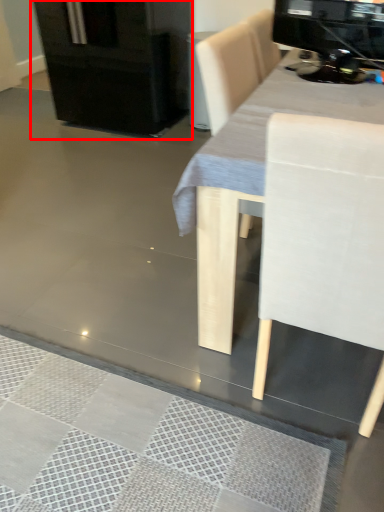
Question: From the image's perspective, considering the relative positions of fridge (annotated by the red box) and appliance in the image provided, where is fridge (annotated by the red box) located with respect to the staircase?

Choices:
 (A) above
 (B) below

Answer: (A)